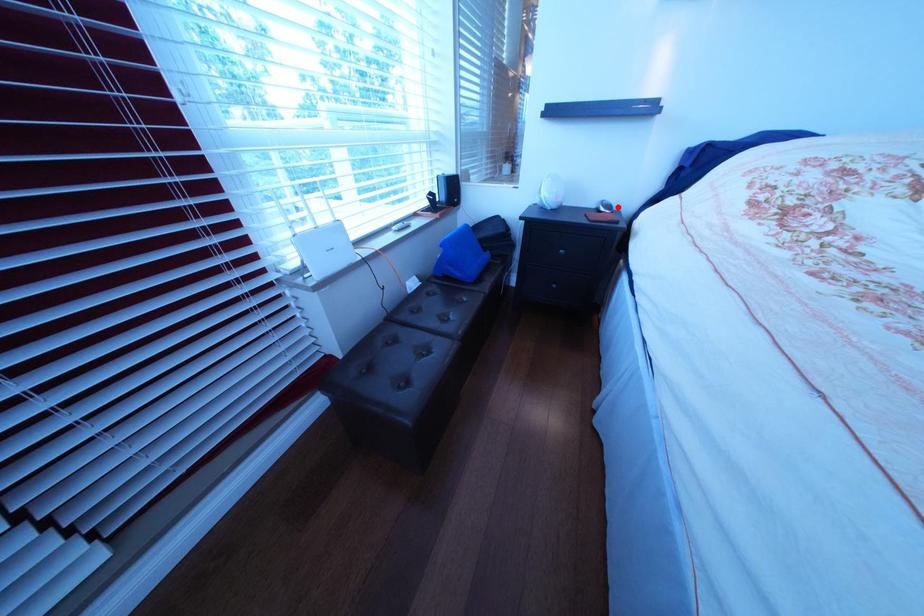
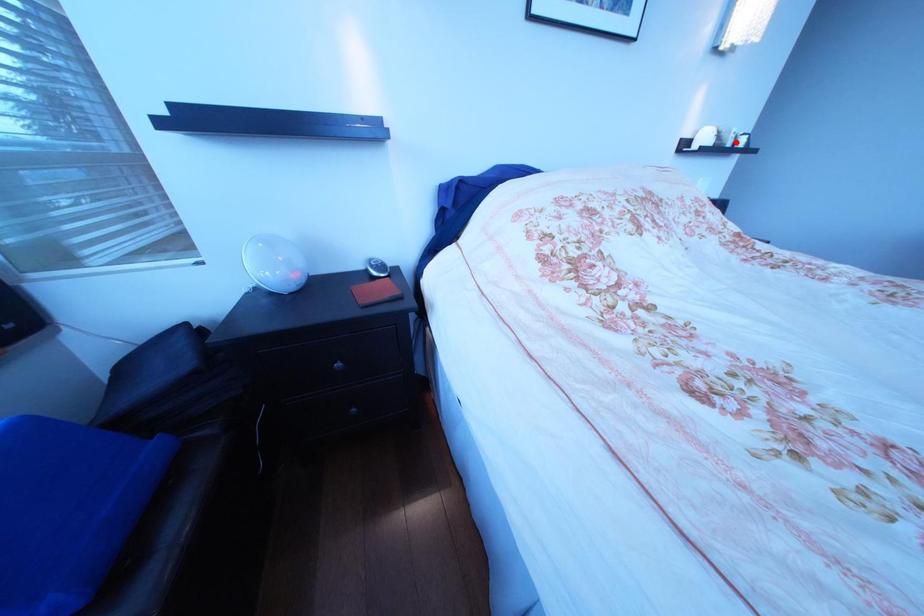
I am providing you with two images of the same scene from different viewpoints. A red point is marked on the first image and another point is marked on the second image. Is the red point in image1 aligned with the point shown in image2?

No